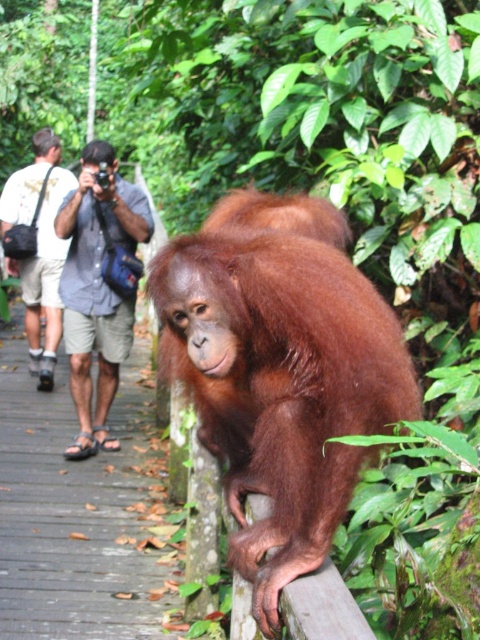
Question: Which point is farther to the camera?

Choices:
 (A) orange fur orangutan at center
 (B) blue denim shirt at upper left
 (C) white t-shirt at left

Answer: (C)

Question: Is blue denim shirt at upper left to the right of white t-shirt at left from the viewer's perspective?

Choices:
 (A) no
 (B) yes

Answer: (B)

Question: Does orange fur orangutan at center come in front of white t-shirt at left?

Choices:
 (A) no
 (B) yes

Answer: (B)

Question: Which object appears farthest from the camera in this image?

Choices:
 (A) white t-shirt at left
 (B) blue denim shirt at upper left

Answer: (A)

Question: Can you confirm if orange fur orangutan at center is positioned below white t-shirt at left?

Choices:
 (A) no
 (B) yes

Answer: (B)

Question: Which of the following is the farthest from the observer?

Choices:
 (A) orange fur orangutan at center
 (B) blue denim shirt at upper left
 (C) white t-shirt at left

Answer: (C)